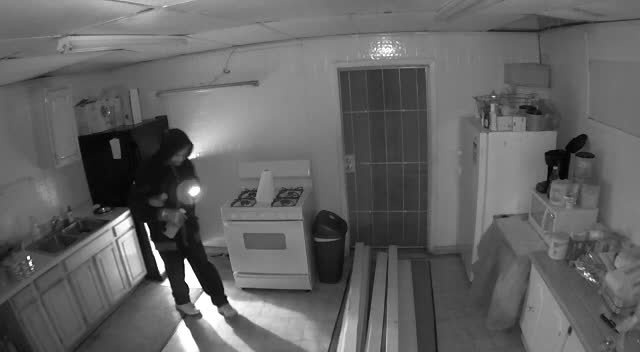
At what (x,y) coordinates should I click in order to perform the action: click on counter top. Please return your answer as a coordinate pair (x, y). This screenshot has width=640, height=352. Looking at the image, I should click on 43,262, 108,218.